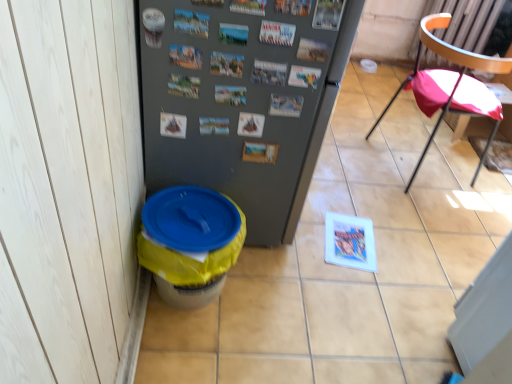
Find the location of a particular element. This screenshot has height=384, width=512. vacant space underneath pink fabric chair at right (from a real-world perspective) is located at coordinates (415, 161).